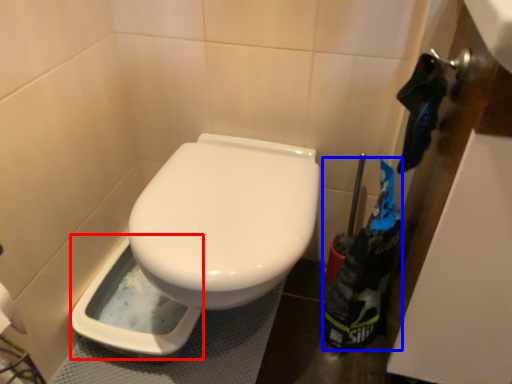
Question: Among these objects, which one is farthest to the camera, bidet (highlighted by a red box) or garbage (highlighted by a blue box)?

Choices:
 (A) bidet
 (B) garbage

Answer: (A)